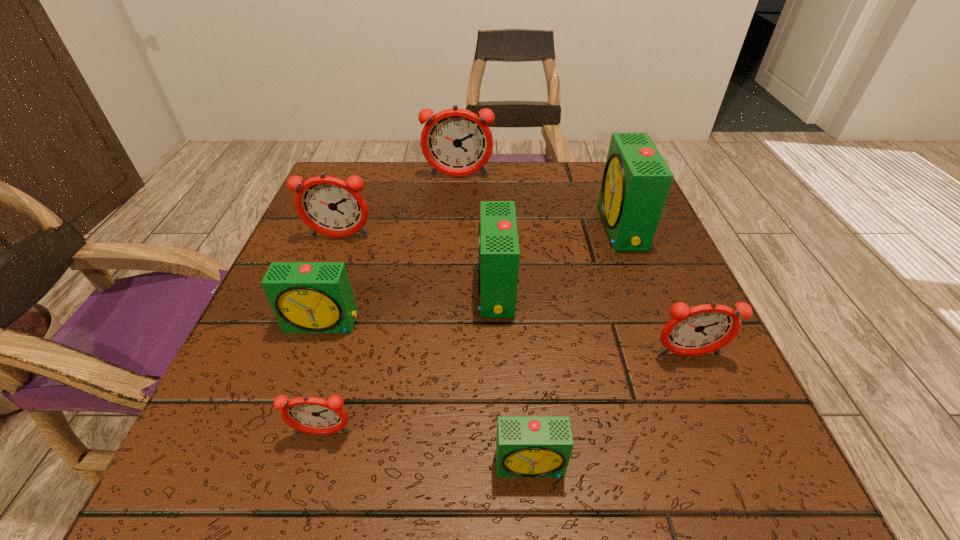
Locate an element on the screen. unoccupied position between the second biggest green alarm clock and the third smallest reddish-pink alarm clock is located at coordinates (418, 264).

Find the location of a particular element. The width and height of the screenshot is (960, 540). object that is the fifth closest to the rightmost green alarm clock is located at coordinates (330, 206).

Locate which object is the closest to the nearest alarm clock. Please provide its 2D coordinates. Your answer should be formatted as a tuple, i.e. [(x, y)], where the tuple contains the x and y coordinates of a point satisfying the conditions above.

[(312, 415)]

This screenshot has height=540, width=960. In order to click on alarm clock object that ranks as the third closest to the sixth farthest object in this screenshot , I will do `click(636, 181)`.

Image resolution: width=960 pixels, height=540 pixels. Find the location of `alarm clock that is the fourth closest to the third smallest reddish-pink alarm clock`. alarm clock that is the fourth closest to the third smallest reddish-pink alarm clock is located at coordinates (312, 415).

At what (x,y) coordinates should I click in order to perform the action: click on reddish-pink alarm clock identified as the fourth closest to the second biggest green alarm clock. Please return your answer as a coordinate pair (x, y). The width and height of the screenshot is (960, 540). Looking at the image, I should click on point(457,142).

In order to click on reddish-pink alarm clock that is the second closest to the farthest alarm clock in this screenshot , I will do `click(702, 329)`.

Identify which green alarm clock is the second closest to the leftmost green alarm clock. Please provide its 2D coordinates. Your answer should be formatted as a tuple, i.e. [(x, y)], where the tuple contains the x and y coordinates of a point satisfying the conditions above.

[(527, 446)]

Image resolution: width=960 pixels, height=540 pixels. Find the location of `the third closest green alarm clock relative to the farthest green alarm clock`. the third closest green alarm clock relative to the farthest green alarm clock is located at coordinates (307, 297).

Locate an element on the screen. The width and height of the screenshot is (960, 540). vacant space that satisfies the following two spatial constraints: 1. on the front-facing side of the biggest green alarm clock; 2. on the front-facing side of the second smallest green alarm clock is located at coordinates (659, 323).